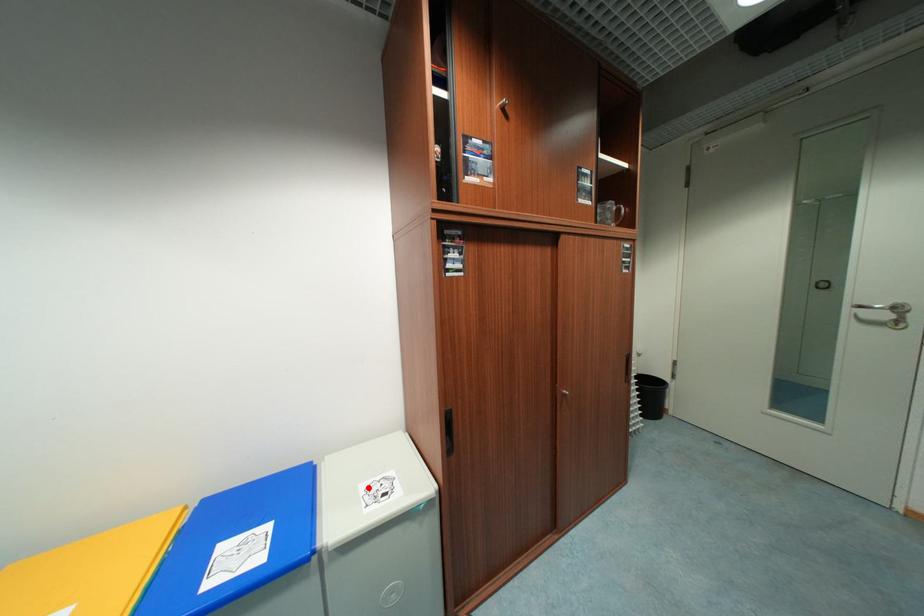
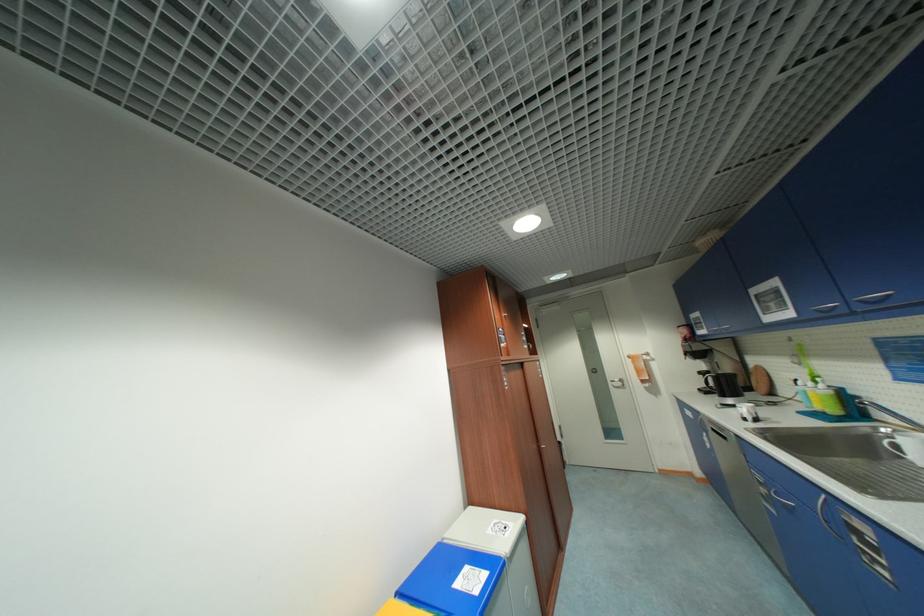
The point at the highlighted location is marked in the first image. Where is the corresponding point in the second image?

(495, 533)